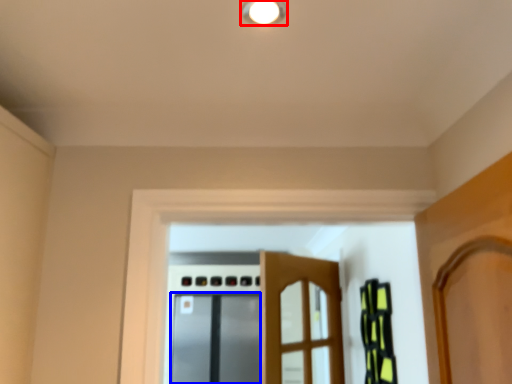
Question: Which object is further to the camera taking this photo, light fixture (highlighted by a red box) or screen door (highlighted by a blue box)?

Choices:
 (A) light fixture
 (B) screen door

Answer: (B)